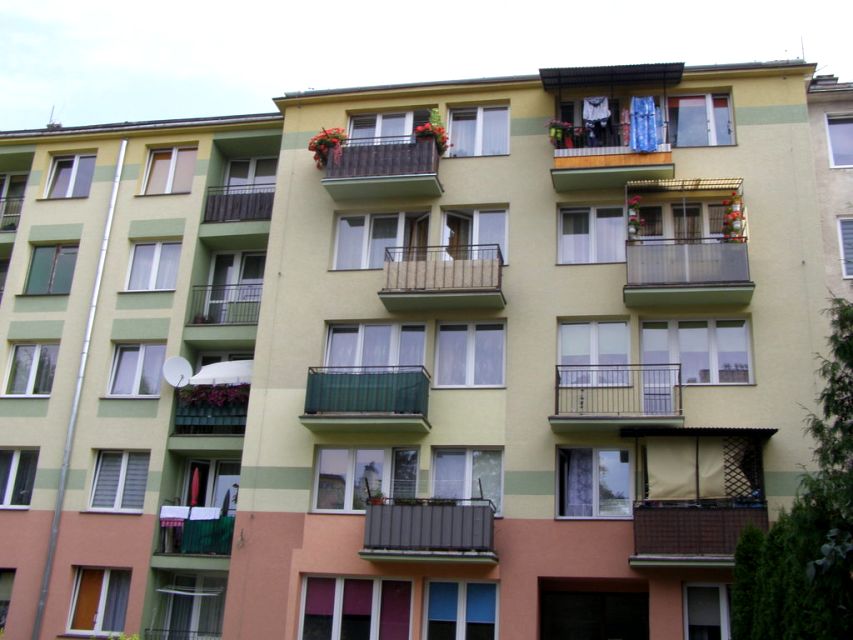
This screenshot has width=853, height=640. What are the coordinates of `red wall` in the screenshot? It's located at click(x=61, y=541), click(x=30, y=532), click(x=265, y=592), click(x=317, y=557), click(x=541, y=550).